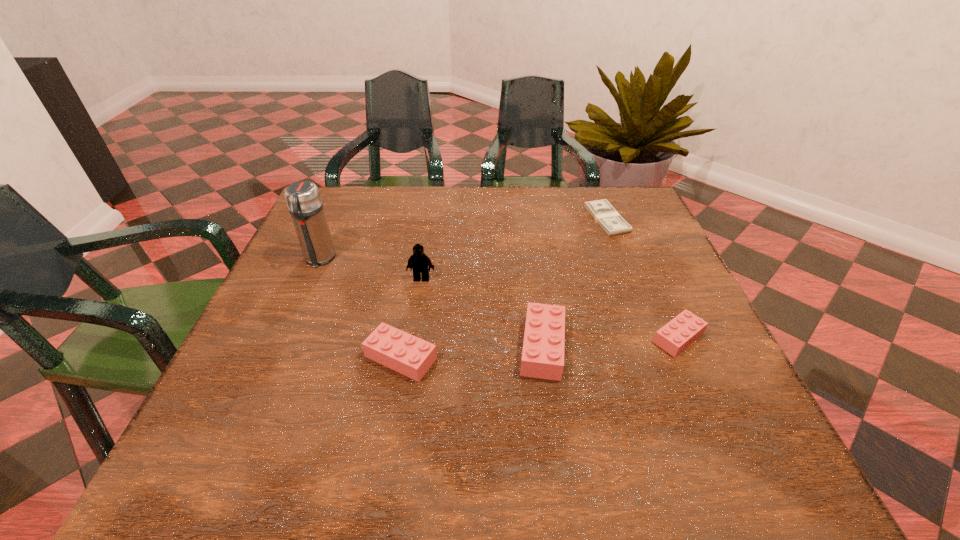
Where is `vacant place for an extra Lego on the left`? Image resolution: width=960 pixels, height=540 pixels. vacant place for an extra Lego on the left is located at coordinates [252, 368].